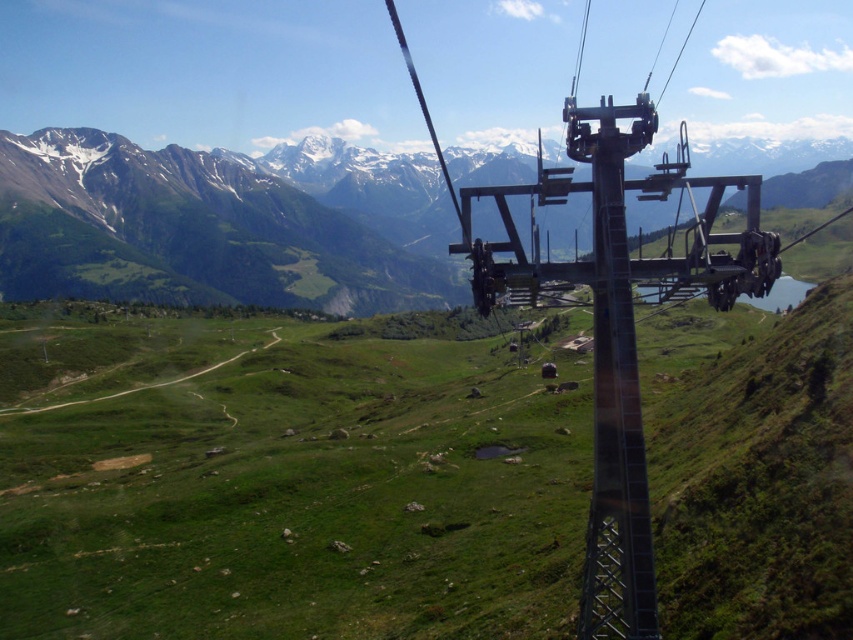
Question: From the image, what is the correct spatial relationship of snowy granite mountain range at upper center in relation to metallic gray pole at center?

Choices:
 (A) left
 (B) right

Answer: (B)

Question: Is snowy granite mountain range at upper center smaller than metallic gray ski lift at center?

Choices:
 (A) yes
 (B) no

Answer: (B)

Question: Among these objects, which one is farthest from the camera?

Choices:
 (A) metallic gray pole at center
 (B) metallic gray ski lift at center

Answer: (B)

Question: Considering the real-world distances, which object is farthest from the snowy granite mountain range at upper center?

Choices:
 (A) metallic gray pole at center
 (B) metallic gray ski lift at center

Answer: (A)

Question: Is snowy granite mountain range at upper center wider than metallic gray ski lift at center?

Choices:
 (A) yes
 (B) no

Answer: (A)

Question: Among these points, which one is farthest from the camera?

Choices:
 (A) (604, 538)
 (B) (846, 176)

Answer: (B)